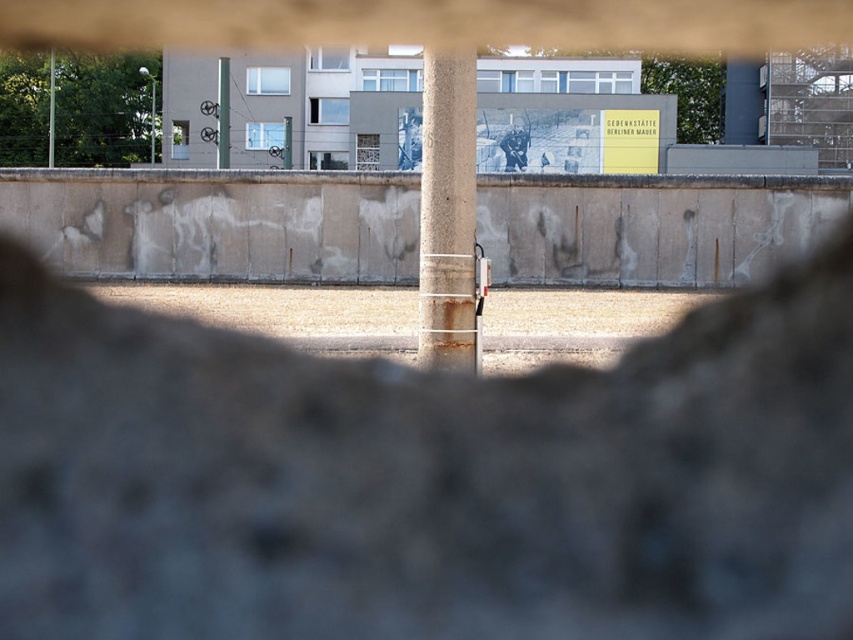
Question: Which point appears farthest from the camera in this image?

Choices:
 (A) (49, 166)
 (B) (288, 132)
 (C) (218, 129)
 (D) (445, 93)

Answer: (A)

Question: Where is smooth concrete pole at center located in relation to green metallic pole at center in the image?

Choices:
 (A) right
 (B) left

Answer: (B)

Question: Considering the real-world distances, which object is farthest from the smooth concrete pole at center?

Choices:
 (A) green metallic pole at center
 (B) rusty concrete pillar at center
 (C) smooth concrete pillar at center

Answer: (B)

Question: Does rusty concrete pillar at center appear under smooth concrete pole at center?

Choices:
 (A) yes
 (B) no

Answer: (A)

Question: Does smooth concrete pole at center lie in front of green metallic pole at center?

Choices:
 (A) yes
 (B) no

Answer: (B)

Question: Which of these objects is positioned farthest from the green metallic pole at center?

Choices:
 (A) rusty concrete pillar at center
 (B) smooth concrete pillar at center

Answer: (A)